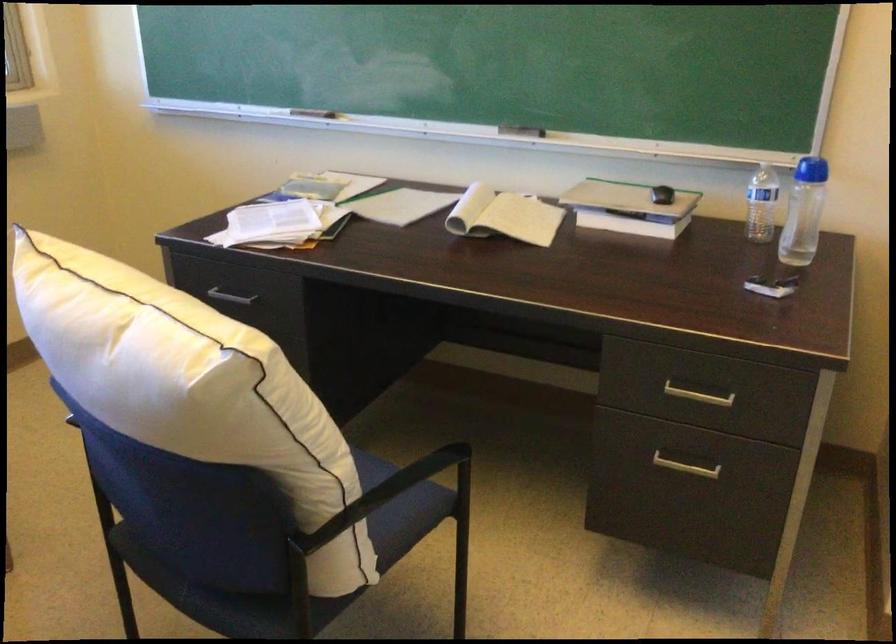
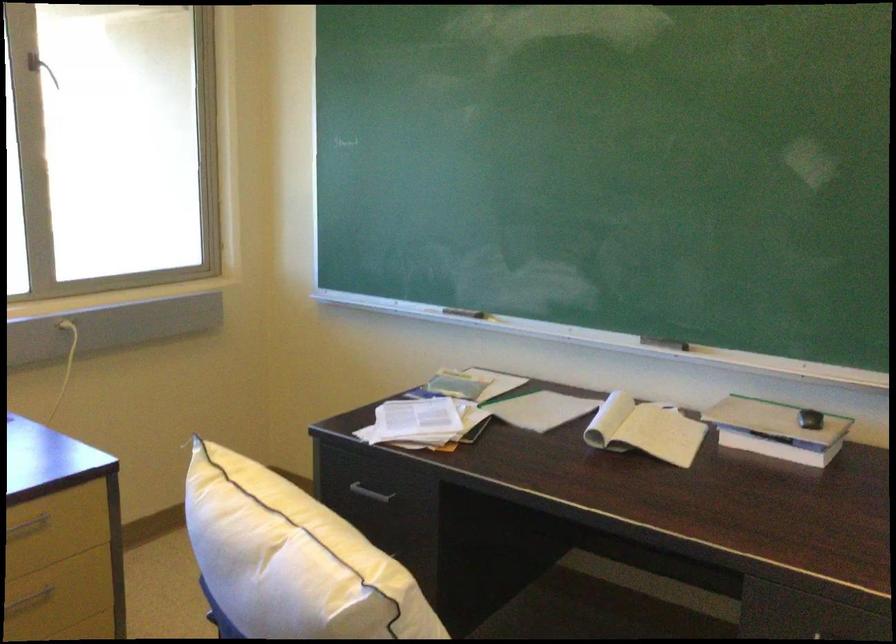
The point at (x=626, y=211) is marked in the first image. Where is the corresponding point in the second image?

(776, 430)